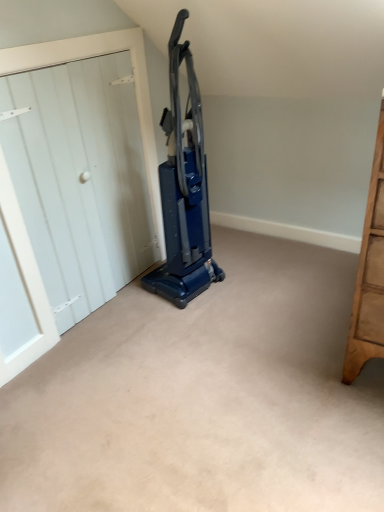
Describe the element at coordinates (184, 189) in the screenshot. I see `blue plastic vacuum cleaner at center` at that location.

In the scene shown: What is the approximate width of blue plastic vacuum cleaner at center?

34.57 centimeters.

In order to face blue plastic vacuum cleaner at center, should I rotate leftwards or rightwards?

It's best to rotate left around 2.969 degrees.

Locate an element on the screen. The image size is (384, 512). blue plastic vacuum cleaner at center is located at coordinates (184, 189).

The height and width of the screenshot is (512, 384). Describe the element at coordinates (78, 179) in the screenshot. I see `white wood door at left` at that location.

Image resolution: width=384 pixels, height=512 pixels. I want to click on white wood door at left, so click(78, 179).

I want to click on blue plastic vacuum cleaner at center, so click(184, 189).

Is blue plastic vacuum cleaner at center to the left or to the right of white wood door at left in the image?

In the image, blue plastic vacuum cleaner at center appears on the right side of white wood door at left.

Is the position of blue plastic vacuum cleaner at center less distant than that of white wood door at left?

No, blue plastic vacuum cleaner at center is further to the viewer.

Is point (166, 164) behind point (102, 255)?

No, (166, 164) is closer to viewer.

From the image's perspective, would you say blue plastic vacuum cleaner at center is positioned over white wood door at left?

Yes, from the image's perspective, blue plastic vacuum cleaner at center is above white wood door at left.

From a real-world perspective, is blue plastic vacuum cleaner at center physically located above or below white wood door at left?

In terms of real-world spatial position, blue plastic vacuum cleaner at center is above white wood door at left.

Is blue plastic vacuum cleaner at center thinner than white wood door at left?

In fact, blue plastic vacuum cleaner at center might be wider than white wood door at left.

Is blue plastic vacuum cleaner at center taller or shorter than white wood door at left?

Considering their sizes, blue plastic vacuum cleaner at center has more height than white wood door at left.

Considering the relative sizes of blue plastic vacuum cleaner at center and white wood door at left in the image provided, is blue plastic vacuum cleaner at center smaller than white wood door at left?

Actually, blue plastic vacuum cleaner at center might be larger than white wood door at left.

Can we say blue plastic vacuum cleaner at center lies outside white wood door at left?

That's correct, blue plastic vacuum cleaner at center is outside of white wood door at left.

Does blue plastic vacuum cleaner at center touch white wood door at left?

No.

Is blue plastic vacuum cleaner at center oriented towards white wood door at left?

No, blue plastic vacuum cleaner at center is not turned towards white wood door at left.

Measure the distance between blue plastic vacuum cleaner at center and white wood door at left.

blue plastic vacuum cleaner at center is 13.45 inches from white wood door at left.

This screenshot has width=384, height=512. In order to click on door below the blue plastic vacuum cleaner at center (from a real-world perspective) in this screenshot , I will do `click(78, 179)`.

Considering the positions of objects white wood door at left and blue plastic vacuum cleaner at center in the image provided, who is more to the right, white wood door at left or blue plastic vacuum cleaner at center?

Positioned to the right is blue plastic vacuum cleaner at center.

Considering the relative positions of white wood door at left and blue plastic vacuum cleaner at center in the image provided, is white wood door at left behind blue plastic vacuum cleaner at center?

No, white wood door at left is closer to the viewer.

Which is closer to the camera, (56, 265) or (175, 291)?

The point (56, 265) is closer.

From the image's perspective, which one is positioned lower, white wood door at left or blue plastic vacuum cleaner at center?

white wood door at left is shown below in the image.

From a real-world perspective, is white wood door at left positioned above or below blue plastic vacuum cleaner at center?

From a real-world perspective, white wood door at left is physically below blue plastic vacuum cleaner at center.

Which of these two, white wood door at left or blue plastic vacuum cleaner at center, is thinner?

With smaller width is white wood door at left.

Between white wood door at left and blue plastic vacuum cleaner at center, which one has less height?

Standing shorter between the two is white wood door at left.

Does white wood door at left have a smaller size compared to blue plastic vacuum cleaner at center?

Yes, white wood door at left is smaller than blue plastic vacuum cleaner at center.

Is blue plastic vacuum cleaner at center a part of white wood door at left?

No.

Are white wood door at left and blue plastic vacuum cleaner at center located far from each other?

That's not correct — white wood door at left is a little close to blue plastic vacuum cleaner at center.

Is white wood door at left looking in the opposite direction of blue plastic vacuum cleaner at center?

Yes, white wood door at left is positioned with its back facing blue plastic vacuum cleaner at center.

This screenshot has height=512, width=384. In order to click on door below the blue plastic vacuum cleaner at center (from the image's perspective) in this screenshot , I will do `click(78, 179)`.

This screenshot has height=512, width=384. Find the location of `equipment that appears above the white wood door at left (from a real-world perspective)`. equipment that appears above the white wood door at left (from a real-world perspective) is located at coordinates (184, 189).

You are a GUI agent. You are given a task and a screenshot of the screen. Output one action in this format:
    pyautogui.click(x=<x>, y=<y>)
    Task: Click on the door that appears below the blue plastic vacuum cleaner at center (from a real-world perspective)
    The height and width of the screenshot is (512, 384).
    Given the screenshot: What is the action you would take?
    pyautogui.click(x=78, y=179)